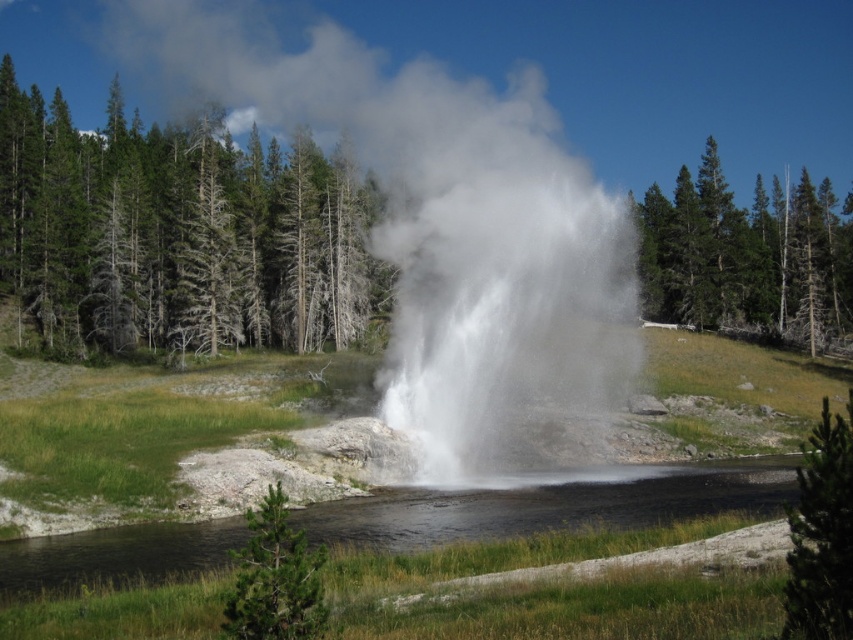
Question: Does green coniferous trees at left have a lesser width compared to green textured pine at lower right?

Choices:
 (A) no
 (B) yes

Answer: (A)

Question: Can you confirm if green coniferous trees at left is smaller than green leafy tree at upper right?

Choices:
 (A) no
 (B) yes

Answer: (B)

Question: Which of these objects is positioned closest to the green textured pine tree at lower left?

Choices:
 (A) green coniferous trees at left
 (B) white vapor at center
 (C) green leafy tree at upper right

Answer: (A)

Question: Which point is closer to the camera?

Choices:
 (A) green textured pine at lower right
 (B) white vapor at center

Answer: (A)

Question: Does green leafy tree at upper right appear over green textured pine at lower right?

Choices:
 (A) no
 (B) yes

Answer: (B)

Question: Which point appears farthest from the camera in this image?

Choices:
 (A) (283, 616)
 (B) (202, 307)

Answer: (B)